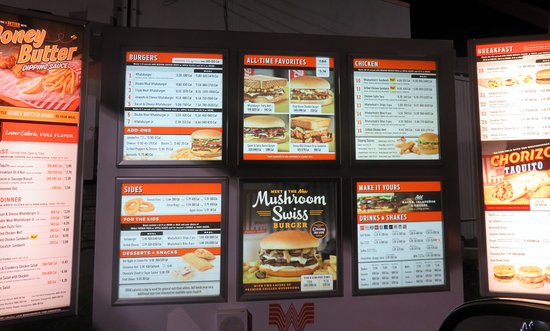
You are a GUI agent. You are given a task and a screenshot of the screen. Output one action in this format:
    pyautogui.click(x=<x>, y=<y>)
    Task: Click on the panels
    
    Given the screenshot: What is the action you would take?
    pyautogui.click(x=38, y=193), pyautogui.click(x=59, y=75), pyautogui.click(x=157, y=93), pyautogui.click(x=174, y=241), pyautogui.click(x=250, y=240), pyautogui.click(x=280, y=123), pyautogui.click(x=363, y=125), pyautogui.click(x=395, y=229), pyautogui.click(x=511, y=225), pyautogui.click(x=519, y=100)